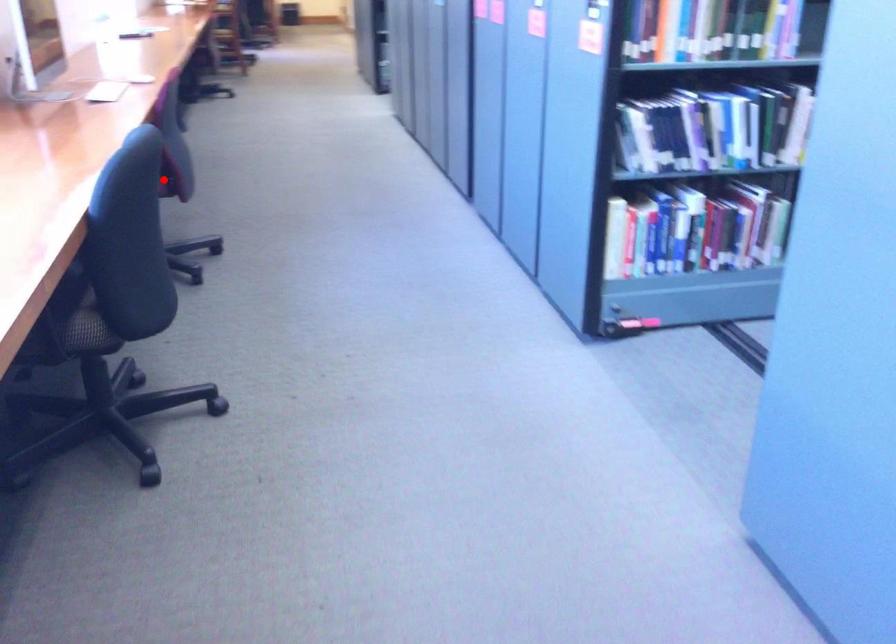
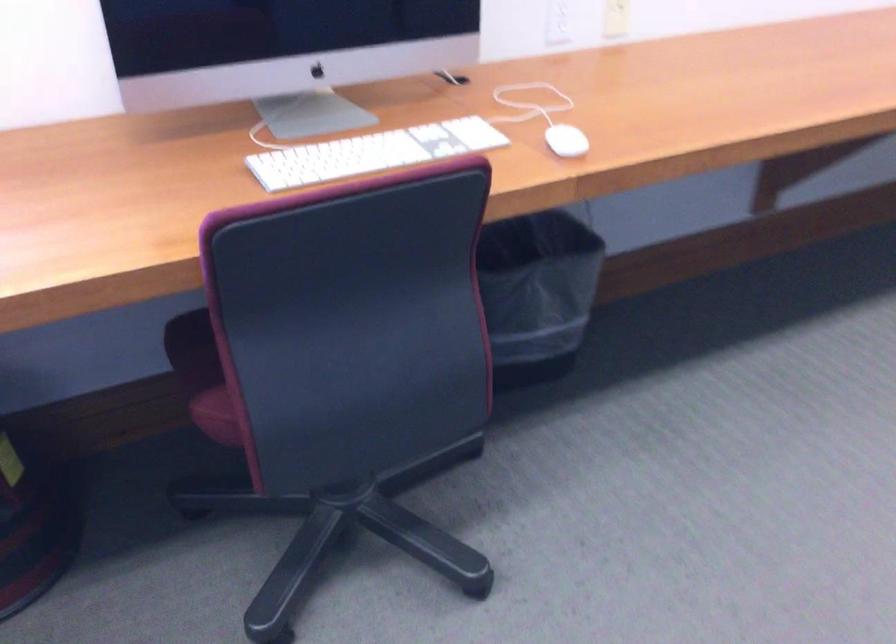
Locate, in the second image, the point that corresponds to the highlighted location in the first image.

(220, 413)